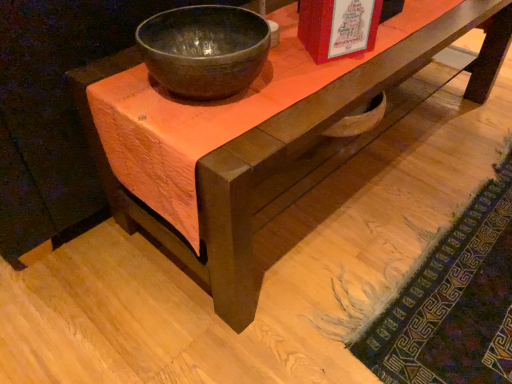
Locate an element on the screen. The width and height of the screenshot is (512, 384). free space to the left of textured wool mat at lower right is located at coordinates (256, 256).